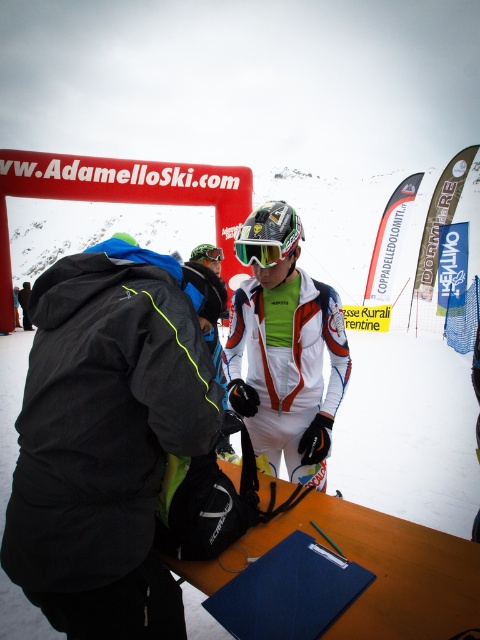
Question: Which point is closer to the camera taking this photo?

Choices:
 (A) (280, 451)
 (B) (244, 227)
 (C) (143, 461)

Answer: (C)

Question: Is matte black jacket at center thinner than glossy plastic goggles at center?

Choices:
 (A) yes
 (B) no

Answer: (B)

Question: Which object is the closest to the matte black jacket at center?

Choices:
 (A) glossy plastic goggles at center
 (B) green matte/glossy goggles at center

Answer: (A)

Question: Which of these objects is positioned closest to the green matte/glossy goggles at center?

Choices:
 (A) matte black jacket at center
 (B) white matte snowboarder at center
 (C) glossy plastic goggles at center

Answer: (B)

Question: Does matte black jacket at center have a greater width compared to white matte snowboarder at center?

Choices:
 (A) no
 (B) yes

Answer: (A)

Question: Is matte black jacket at center further to camera compared to white matte snowboarder at center?

Choices:
 (A) yes
 (B) no

Answer: (B)